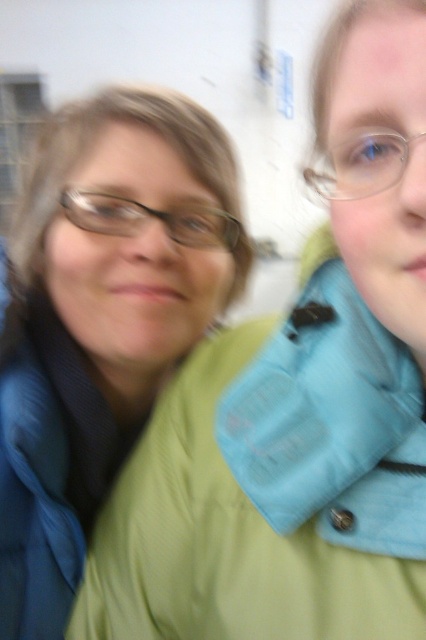
How far apart are green matte jacket at upper left and clear plastic glasses at upper right?

The distance of green matte jacket at upper left from clear plastic glasses at upper right is 12.92 inches.

Which is below, green matte jacket at upper left or clear plastic glasses at upper right?

green matte jacket at upper left is lower down.

Locate an element on the screen. This screenshot has width=426, height=640. green matte jacket at upper left is located at coordinates (100, 317).

Does green matte jacket at upper left have a greater height compared to matte black glasses at left?

Yes, green matte jacket at upper left is taller than matte black glasses at left.

Does green matte jacket at upper left lie behind matte black glasses at left?

No.

Is point (40, 314) positioned behind point (221, 234)?

Yes.

Find the location of a particular element. This screenshot has width=426, height=640. green matte jacket at upper left is located at coordinates (100, 317).

Who is shorter, matte black glasses at left or clear plastic glasses at upper right?

clear plastic glasses at upper right is shorter.

Find the location of a particular element. matte black glasses at left is located at coordinates (149, 220).